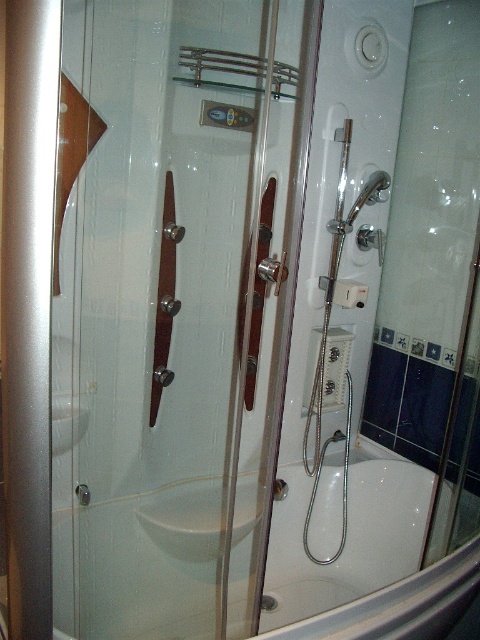
In the scene shown: You are standing in the bathroom and want to reach the point at coordinates (41,625). If your arm can extend 24 inches, can you comfortably reach that point?

The point at coordinates (41,625) is 25.78 inches from the viewer, which is slightly beyond your arm extension of 24 inches. You may need to stretch or take a step closer to reach it comfortably.

You are a contractor measuring door heights for a renovation project. You need to ensure that the transparent glass door at center and the satin silver screen door at left meet specific height requirements. Which door is taller?

The transparent glass door at center is taller than the satin silver screen door at left according to the description provided.